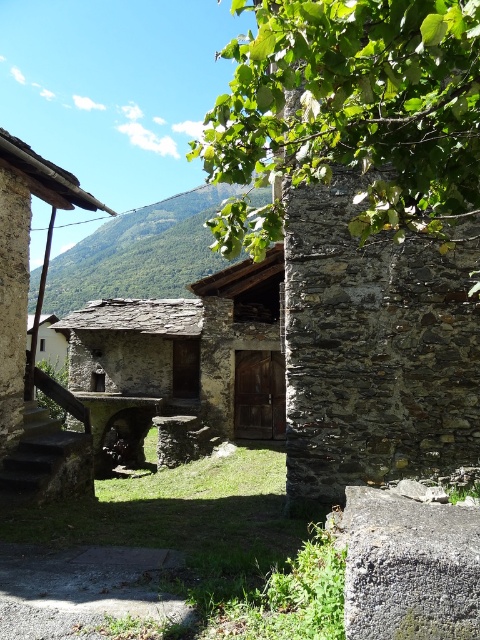
Who is positioned more to the left, gray rough stone at center or green leafy mountain at upper center?

Positioned to the left is green leafy mountain at upper center.

What do you see at coordinates (408, 566) in the screenshot?
I see `gray rough stone at center` at bounding box center [408, 566].

Between point (362, 504) and point (111, 257), which one is positioned behind?

Point (111, 257)

The height and width of the screenshot is (640, 480). I want to click on gray rough stone at center, so click(x=408, y=566).

Who is more forward, (177, 324) or (477, 566)?

Point (477, 566)

Is rustic stone hut at center in front of gray rough stone at center?

No, it is not.

The image size is (480, 640). I want to click on rustic stone hut at center, so click(184, 362).

Which of these two, green leafy tree at upper center or rustic stone hut at center, stands shorter?

Standing shorter between the two is rustic stone hut at center.

Does green leafy tree at upper center appear over rustic stone hut at center?

Indeed, green leafy tree at upper center is positioned over rustic stone hut at center.

Between point (468, 64) and point (153, 372), which one is positioned in front?

Point (468, 64)

The image size is (480, 640). Find the location of `green leafy tree at upper center`. green leafy tree at upper center is located at coordinates (357, 104).